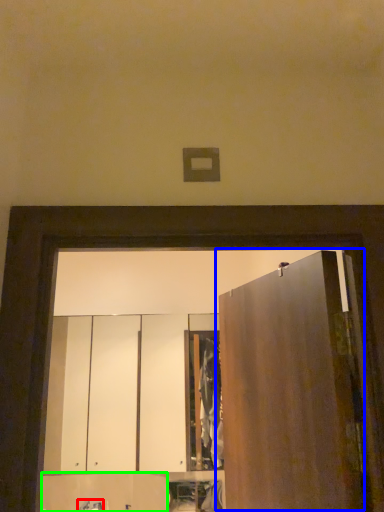
Question: Considering the real-world distances, which object is farthest from faucet (highlighted by a red box)? door (highlighted by a blue box) or cabinetry (highlighted by a green box)?

Choices:
 (A) door
 (B) cabinetry

Answer: (A)